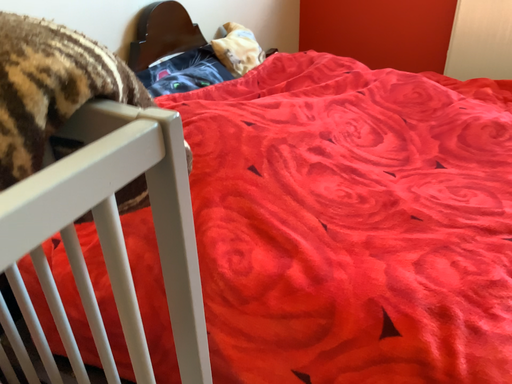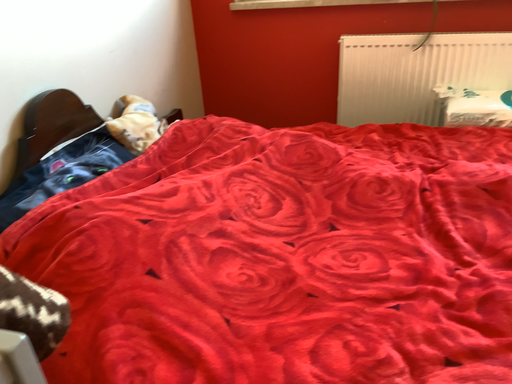
Question: Which way did the camera rotate in the video?

Choices:
 (A) rotated right
 (B) rotated left

Answer: (A)